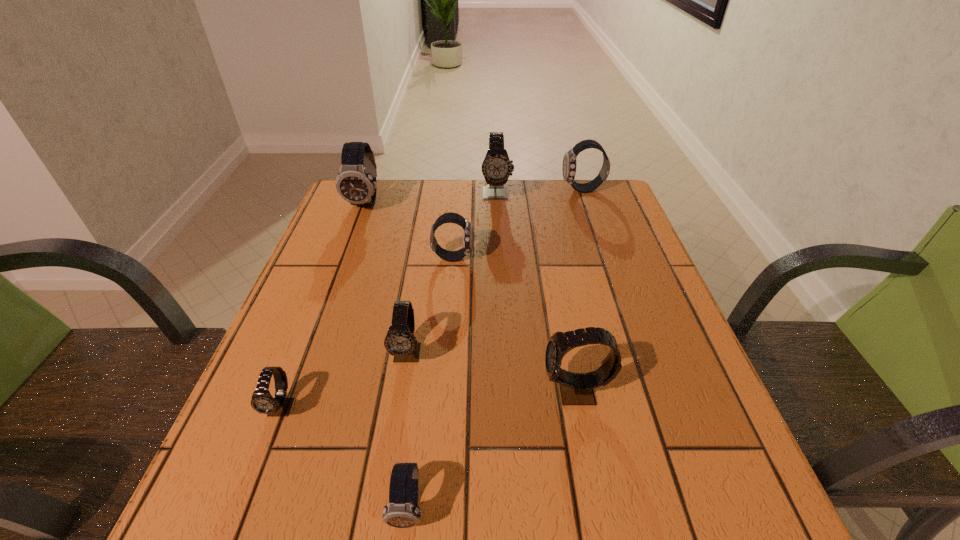
Locate an element on the screen. The width and height of the screenshot is (960, 540). the sixth object from left to right is located at coordinates pyautogui.click(x=496, y=168).

Locate an element on the screen. The width and height of the screenshot is (960, 540). the third watch from right to left is located at coordinates (496, 168).

Find the location of `the leftmost dark watch`. the leftmost dark watch is located at coordinates (356, 183).

The height and width of the screenshot is (540, 960). What are the coordinates of `the second biggest dark watch` in the screenshot? It's located at (569, 166).

Locate an element on the screen. This screenshot has height=540, width=960. the rightmost watch is located at coordinates (569, 166).

Locate an element on the screen. This screenshot has width=960, height=540. the second biggest gray watch is located at coordinates (576, 389).

The width and height of the screenshot is (960, 540). Identify the location of the rightmost gray watch. (576, 389).

The image size is (960, 540). What are the coordinates of `the fifth nearest watch` in the screenshot? It's located at (451, 256).

Find the location of a particular element. Image resolution: width=960 pixels, height=540 pixels. the third biggest dark watch is located at coordinates (451, 256).

Identify the location of the third nearest gray watch. (400, 342).